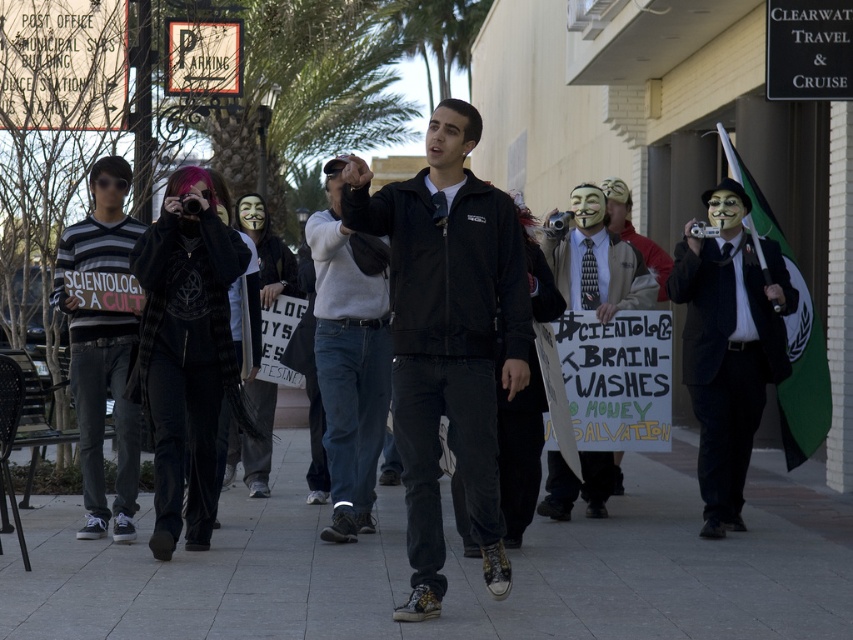
Does black jacket at center have a lesser width compared to matte black suit at center?

No.

At what (x,y) coordinates should I click in order to perform the action: click on black jacket at center. Please return your answer as a coordinate pair (x, y). Looking at the image, I should click on (448, 339).

Is point (689, 291) positioned before point (354, 401)?

No.

Is matte black suit at right further to the viewer compared to dark gray sweater at center?

Yes, it is behind dark gray sweater at center.

Is point (700, 342) positioned after point (329, 237)?

Yes, point (700, 342) is behind point (329, 237).

In order to click on matte black suit at right in this screenshot , I will do (x=728, y=346).

Looking at this image, who is taller, gray concrete pavement at center or matte black suit at right?

With more height is matte black suit at right.

Based on the photo, does gray concrete pavement at center have a greater height compared to matte black suit at right?

No, gray concrete pavement at center is not taller than matte black suit at right.

Who is more forward, (231, 609) or (744, 529)?

Point (231, 609)

The image size is (853, 640). I want to click on gray concrete pavement at center, so click(450, 570).